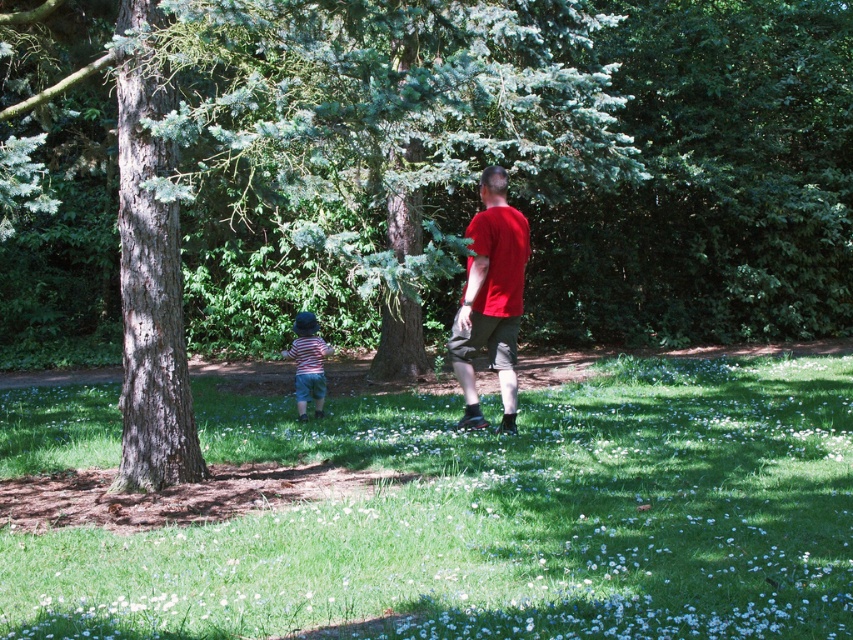
Question: Can you confirm if green grassy field at center is positioned to the left of striped cotton shirt at center?

Choices:
 (A) no
 (B) yes

Answer: (A)

Question: Which point is farther to the camera?

Choices:
 (A) (515, 332)
 (B) (321, 416)
 (C) (131, 60)
 (D) (0, 611)

Answer: (B)

Question: Is green textured tree at center to the left of smooth brown tree trunk at left from the viewer's perspective?

Choices:
 (A) yes
 (B) no

Answer: (B)

Question: From the image, what is the correct spatial relationship of matte red t-shirt at center in relation to striped cotton shirt at center?

Choices:
 (A) above
 (B) below

Answer: (A)

Question: Based on their relative distances, which object is farther from the matte red t-shirt at center?

Choices:
 (A) green textured tree at center
 (B) green grassy field at center

Answer: (A)

Question: Which of the following is the farthest from the observer?

Choices:
 (A) (173, 193)
 (B) (450, 513)
 (C) (306, 324)

Answer: (C)